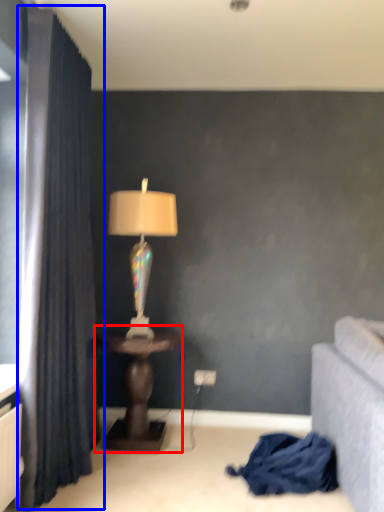
Question: Which point is further to the camera, table (highlighted by a red box) or curtain (highlighted by a blue box)?

Choices:
 (A) table
 (B) curtain

Answer: (A)